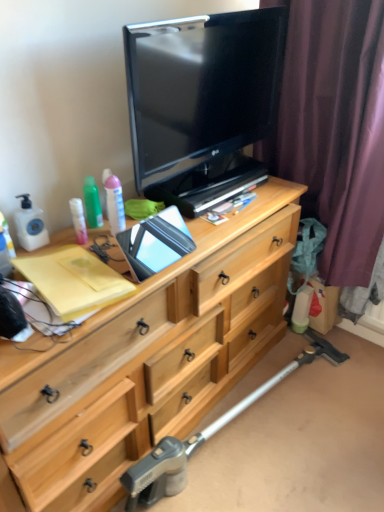
Question: Considering the positions of light wood chest of drawers at center and metallic silver crutch at lower center in the image, is light wood chest of drawers at center taller or shorter than metallic silver crutch at lower center?

Choices:
 (A) tall
 (B) short

Answer: (A)

Question: From the image's perspective, is light wood chest of drawers at center above or below metallic silver crutch at lower center?

Choices:
 (A) above
 (B) below

Answer: (A)

Question: Based on their relative distances, which object is nearer to the matte black tv at upper center?

Choices:
 (A) purple fabric curtain at right
 (B) green matte spray can at upper left
 (C) light wood chest of drawers at center
 (D) metallic silver crutch at lower center

Answer: (A)

Question: Estimate the real-world distances between objects in this image. Which object is closer to the green matte spray can at upper left?

Choices:
 (A) light wood chest of drawers at center
 (B) matte black tv at upper center
 (C) metallic silver crutch at lower center
 (D) purple fabric curtain at right

Answer: (B)